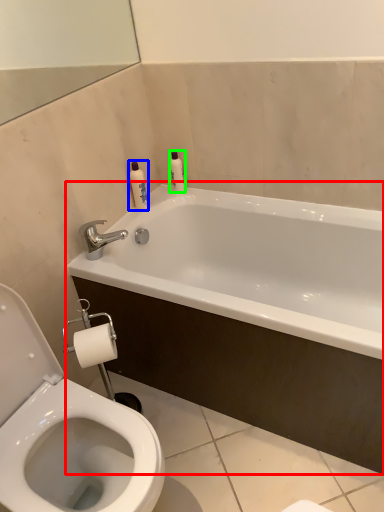
Question: Based on their relative distances, which object is nearer to bathtub (highlighted by a red box)? Choose from toiletry (highlighted by a blue box) and toiletry (highlighted by a green box).

Choices:
 (A) toiletry
 (B) toiletry

Answer: (A)